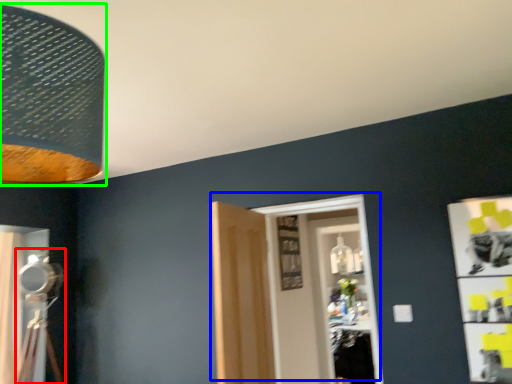
Question: Based on their relative distances, which object is farther from table lamp (highlighted by a red box)? Choose from door (highlighted by a blue box) and lamp (highlighted by a green box).

Choices:
 (A) door
 (B) lamp

Answer: (B)